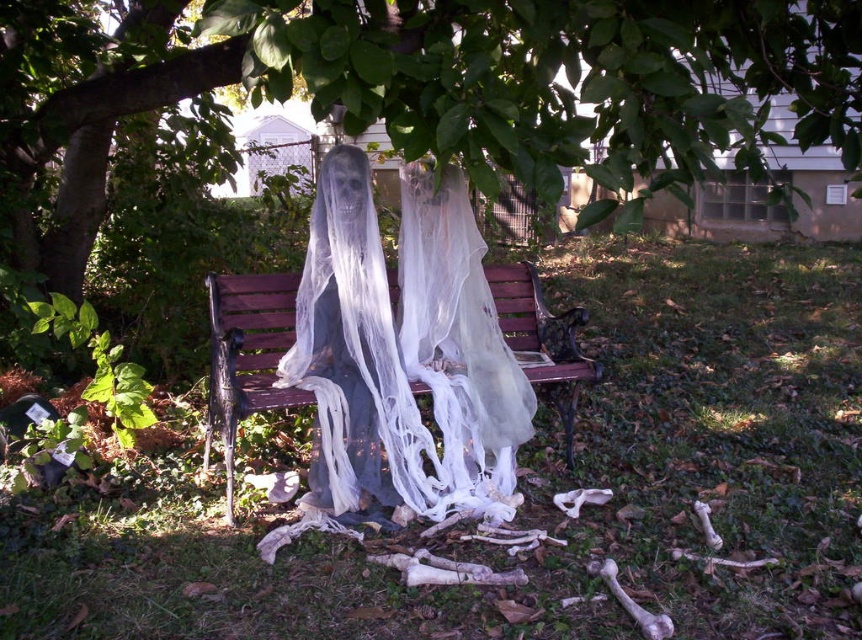
Does green leafy tree at upper center appear over wooden bench at center?

Yes, green leafy tree at upper center is above wooden bench at center.

Can you confirm if green leafy tree at upper center is positioned to the right of wooden bench at center?

Correct, you'll find green leafy tree at upper center to the right of wooden bench at center.

What do you see at coordinates (413, 92) in the screenshot?
I see `green leafy tree at upper center` at bounding box center [413, 92].

The image size is (862, 640). I want to click on green leafy tree at upper center, so click(x=413, y=92).